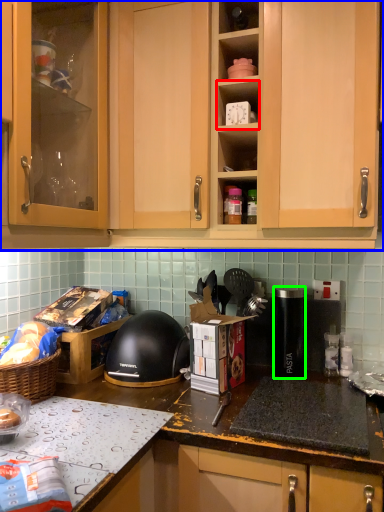
Question: Which object is positioned farthest from shelf (highlighted by a red box)? Select from cabinetry (highlighted by a blue box) and kitchen appliance (highlighted by a green box).

Choices:
 (A) cabinetry
 (B) kitchen appliance

Answer: (B)